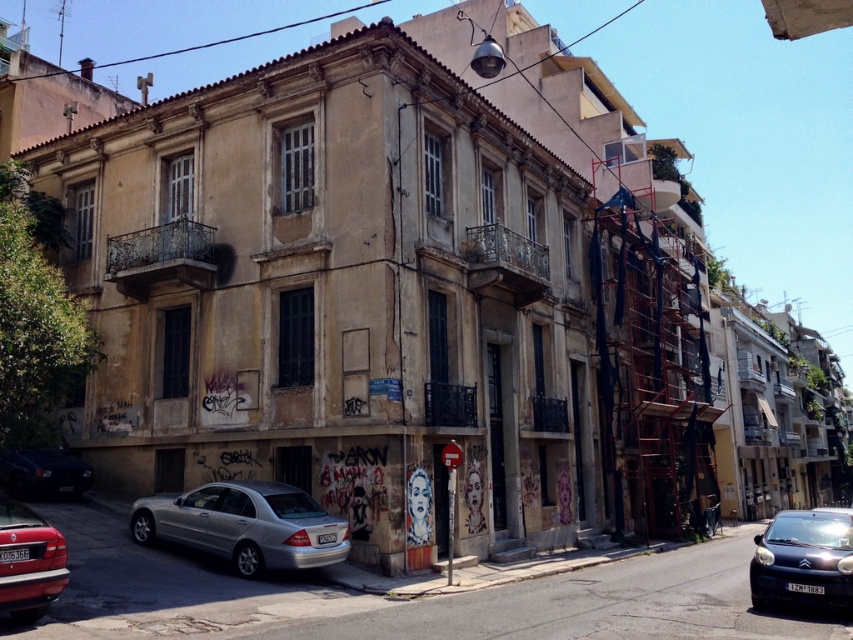
Question: Which point is closer to the camera?

Choices:
 (A) [32, 525]
 (B) [305, 566]
 (C) [28, 483]
 (D) [755, 600]

Answer: (A)

Question: Is shiny black car at lower right thinner than dark blue matte car at lower left?

Choices:
 (A) yes
 (B) no

Answer: (B)

Question: Which of the following is the farthest from the observer?

Choices:
 (A) [827, 536]
 (B) [10, 460]
 (C) [209, 508]
 (D) [67, 570]

Answer: (B)

Question: Which point is closer to the camera?

Choices:
 (A) (70, 464)
 (B) (39, 525)

Answer: (B)

Question: Can you confirm if silver metallic car at lower center is positioned above dark blue matte car at lower left?

Choices:
 (A) yes
 (B) no

Answer: (B)

Question: Is shiny black car at lower right wider than dark blue matte car at lower left?

Choices:
 (A) yes
 (B) no

Answer: (A)